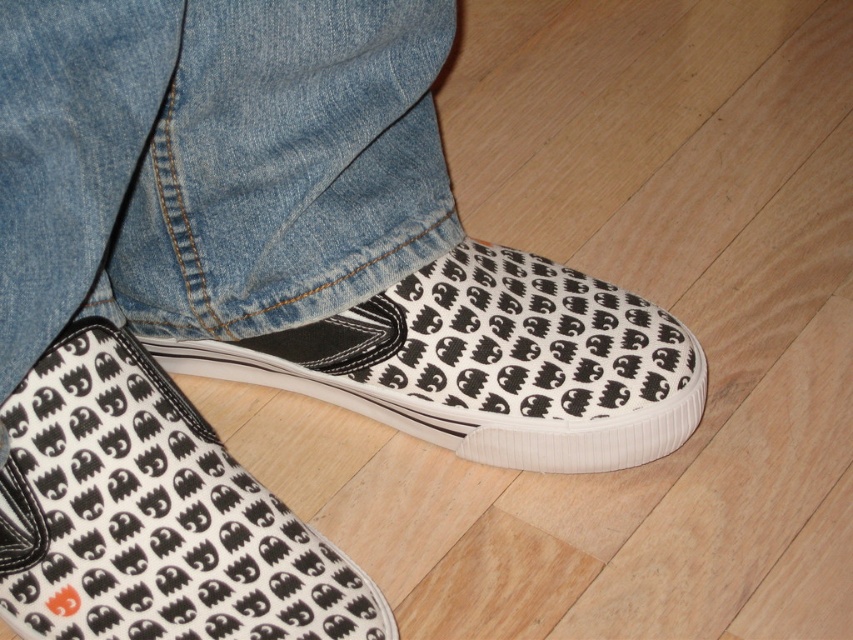
Question: Is white canvas shoe at lower center to the right of white canvas shoe at center from the viewer's perspective?

Choices:
 (A) yes
 (B) no

Answer: (B)

Question: Which point appears farthest from the camera in this image?

Choices:
 (A) (244, 545)
 (B) (335, 356)

Answer: (B)

Question: Can you confirm if white canvas shoe at lower center is positioned to the left of white canvas shoe at center?

Choices:
 (A) no
 (B) yes

Answer: (B)

Question: Which point is closer to the camera?

Choices:
 (A) (505, 349)
 (B) (126, 333)

Answer: (B)

Question: Where is white canvas shoe at lower center located in relation to white canvas shoe at center in the image?

Choices:
 (A) left
 (B) right

Answer: (A)